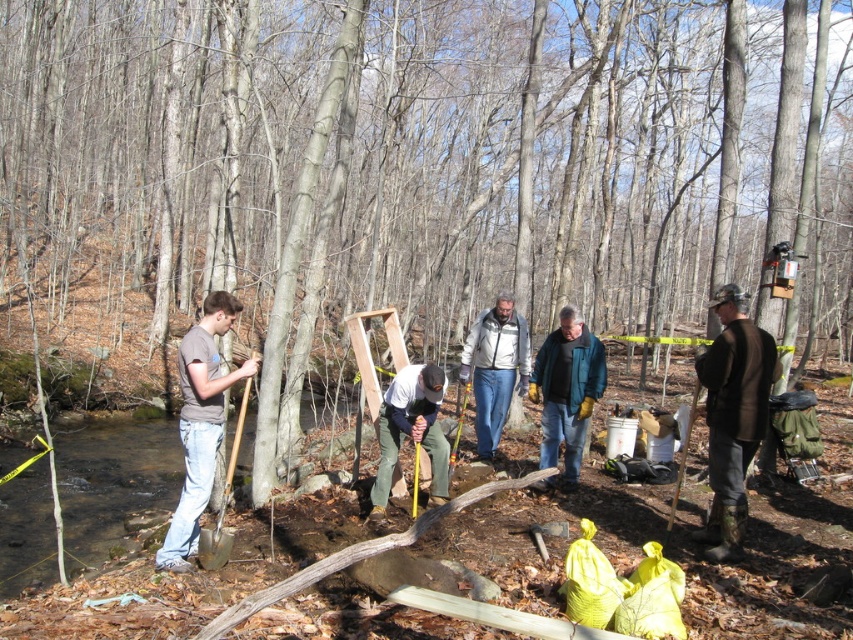
You are a hiker who needs to choose between two jackets available in the woods. The teal jacket at center and the light gray jacket at center. Based on their sizes, which jacket might be more suitable for carrying a backpack?

The light gray jacket at center has a larger width than the teal jacket at center, making it more suitable for comfortably carrying a backpack.